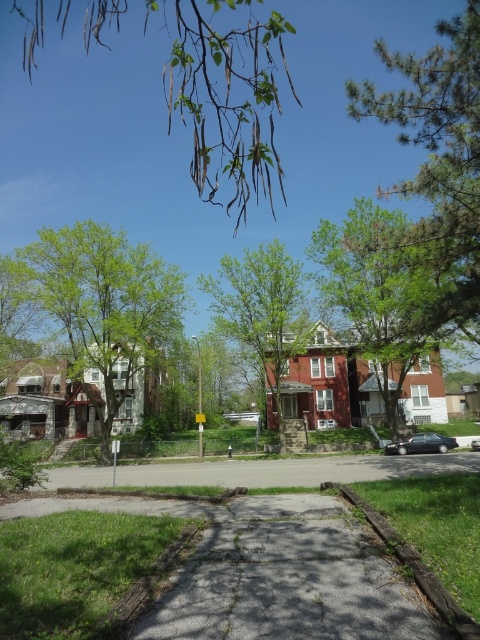
Question: Which point is farther to the camera?

Choices:
 (A) brown wooden curb at lower right
 (B) green leafy tree at left

Answer: (B)

Question: Which object appears closest to the camera in this image?

Choices:
 (A) green leafy tree at left
 (B) green leafy branches at upper center
 (C) green leafy tree at upper center
 (D) brown wooden curb at lower right

Answer: (B)

Question: In this image, where is green leafy branches at upper center located relative to gray asphalt pavement at center?

Choices:
 (A) below
 (B) above

Answer: (B)

Question: Can you confirm if gray asphalt pavement at center is positioned below green leafy tree at center?

Choices:
 (A) yes
 (B) no

Answer: (A)

Question: Estimate the real-world distances between objects in this image. Which object is farther from the shiny black sedan at lower right?

Choices:
 (A) green pine tree at upper right
 (B) green leafy tree at center
 (C) green leafy branches at upper center
 (D) green leafy tree at upper center

Answer: (C)

Question: Does gray concrete pavement at center appear under brown wooden curb at lower right?

Choices:
 (A) no
 (B) yes

Answer: (B)